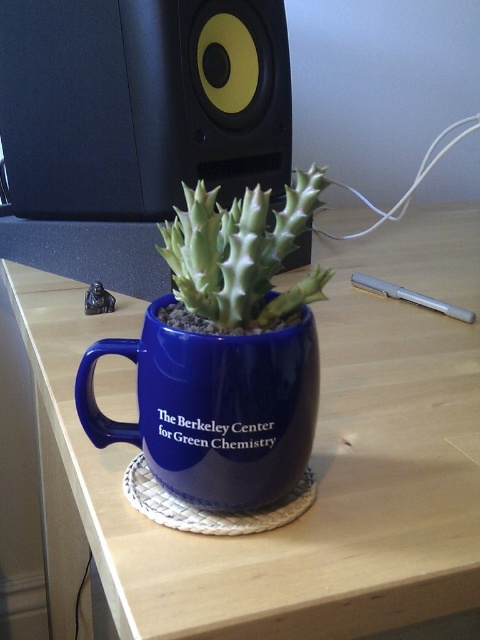
Looking at this image, you are designing a layout for a virtual reality room and need to place a virtual object at coordinate point 0.639, 0.448. The scene already has a blue ceramic mug at center. Can you place your object there without overlapping?

The blue ceramic mug at center is already positioned at point (215, 408), so placing another object there would cause overlap. Choose a different coordinate.

You are setting up a new plant on a wooden table at center. There is already a blue ceramic mug at center. Can the plant be placed directly under the mug without moving the mug?

The wooden table at center is positioned over blue ceramic mug at center, meaning the mug is already on the table. Since the plant is inside the mug, it is already placed under the mug without needing to move it.